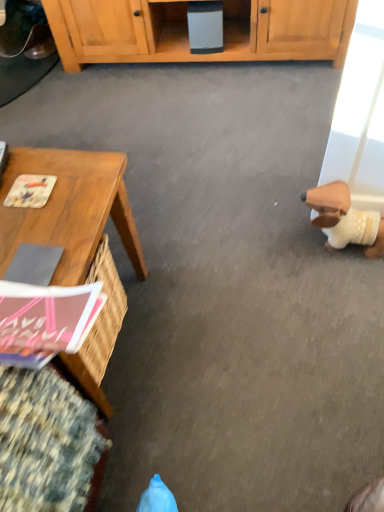
This screenshot has width=384, height=512. In order to click on vacant space in between brown plush toy at right and wooden desk at left in this screenshot , I will do `click(232, 291)`.